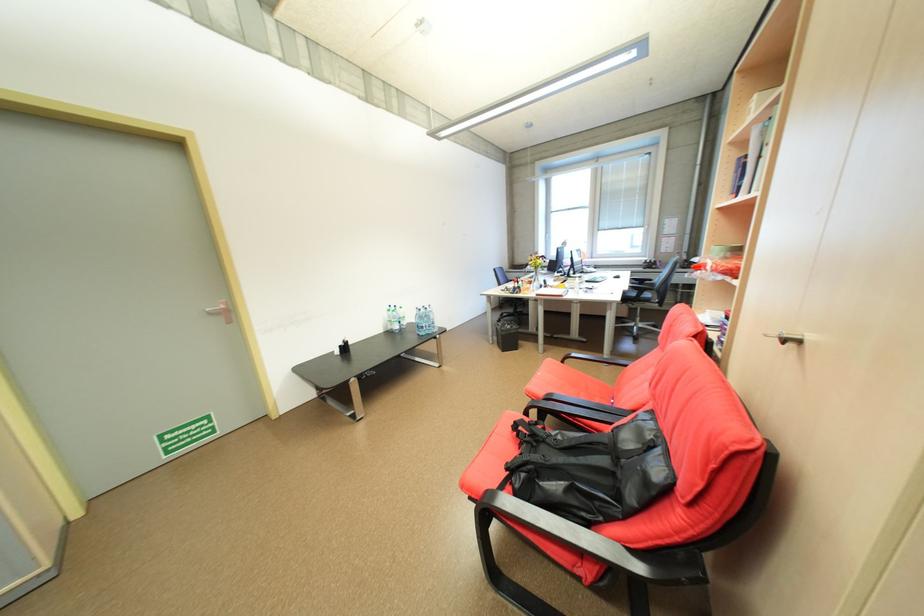
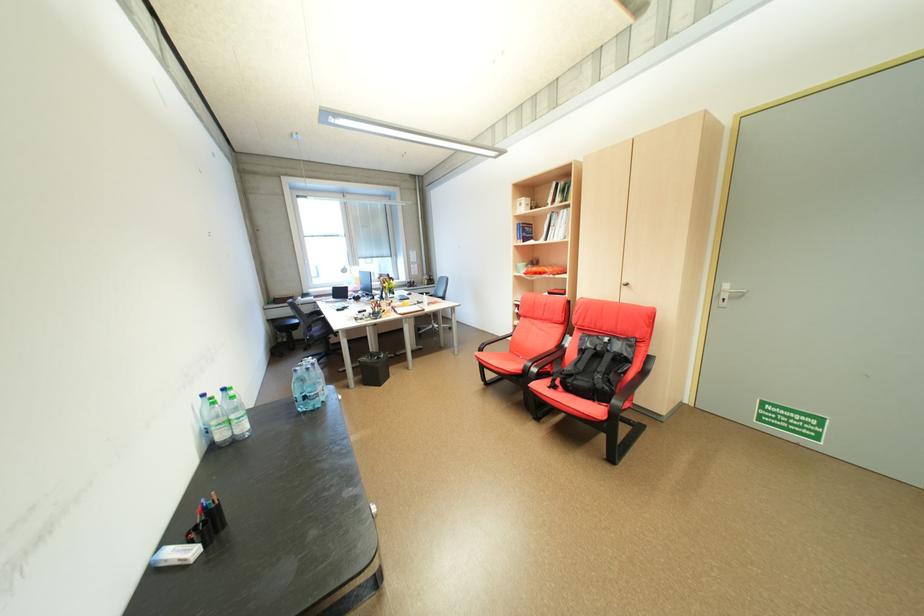
In the second image, find the point that corresponds to [517,342] in the first image.

(382, 377)